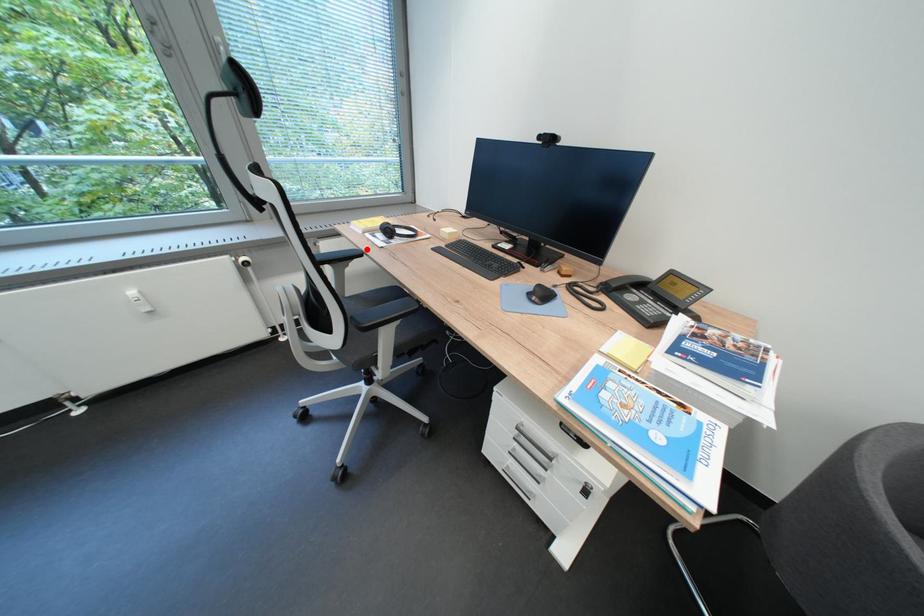
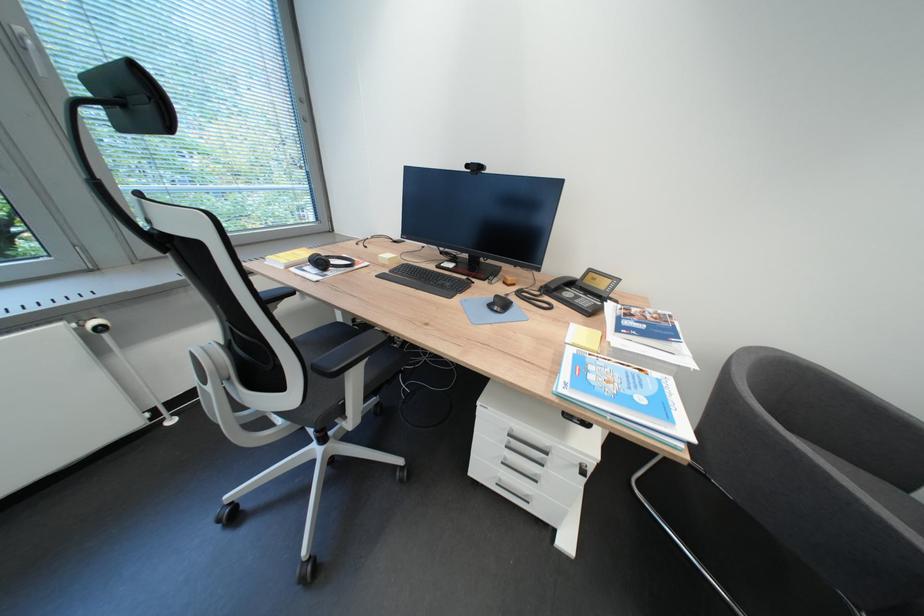
In the second image, find the point that corresponds to the highlighted location in the first image.

(292, 286)